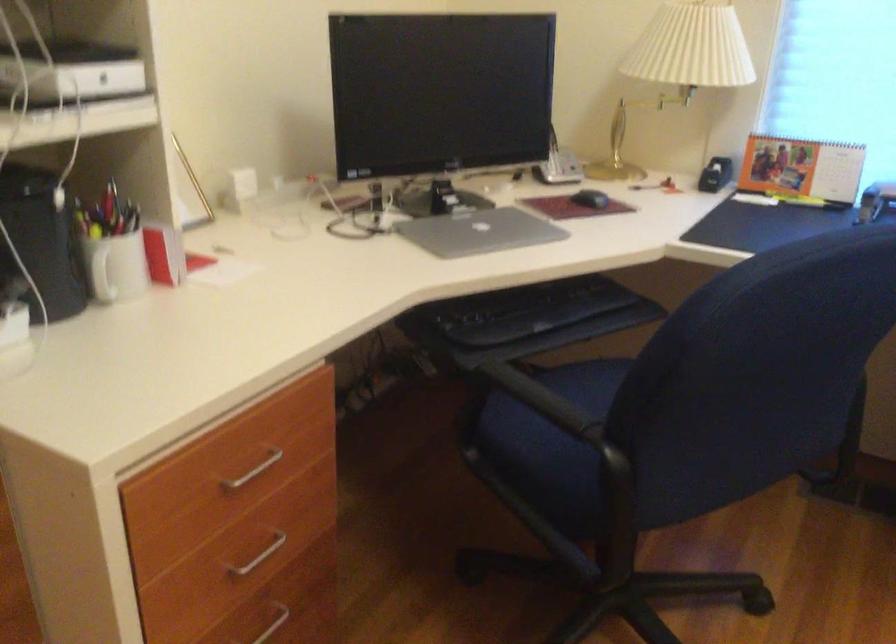
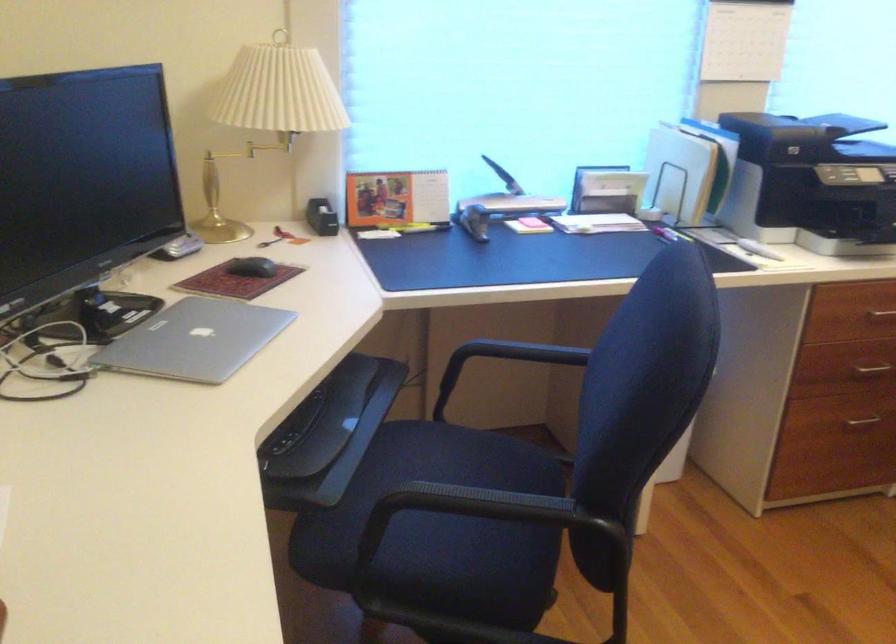
In the second image, find the point that corresponds to (x=590, y=198) in the first image.

(252, 267)